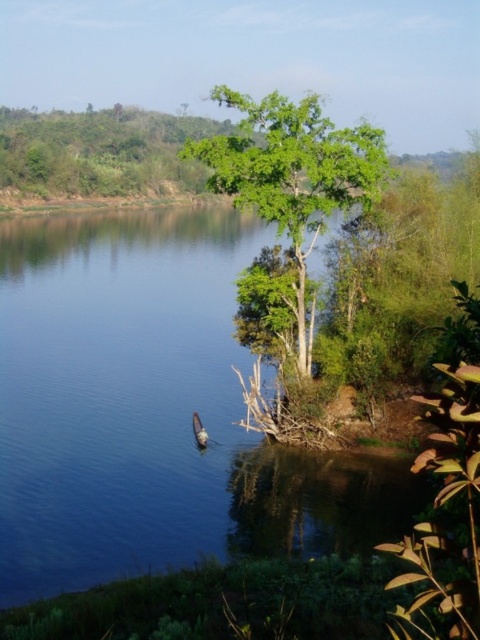
You are a photographer positioned at the point marked by coordinates point (149,410). You want to capture a photo of the small boat floating on the water. Based on the scene description, can you determine if the boat will be visible in your photo?

The point (149,410) corresponds to blue smooth water at center, so the boat floating on the water would be visible in the photo as it is located in the middle distance closer to the left side of the image.